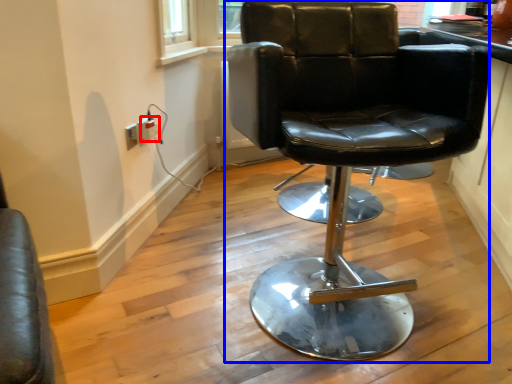
Question: Which of the following is the farthest to the observer, electric outlet (highlighted by a red box) or chair (highlighted by a blue box)?

Choices:
 (A) electric outlet
 (B) chair

Answer: (A)